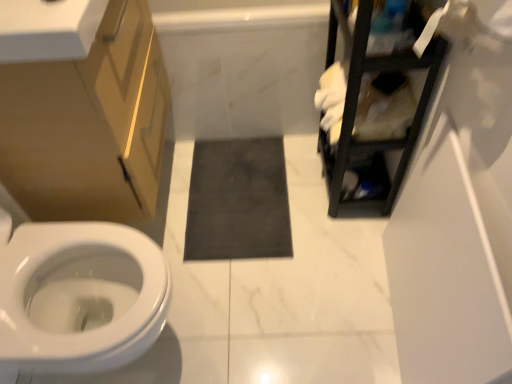
Locate an element on the screen. This screenshot has height=384, width=512. free space between matte gold cabinet at left and dark gray matte bath mat at center is located at coordinates (220, 264).